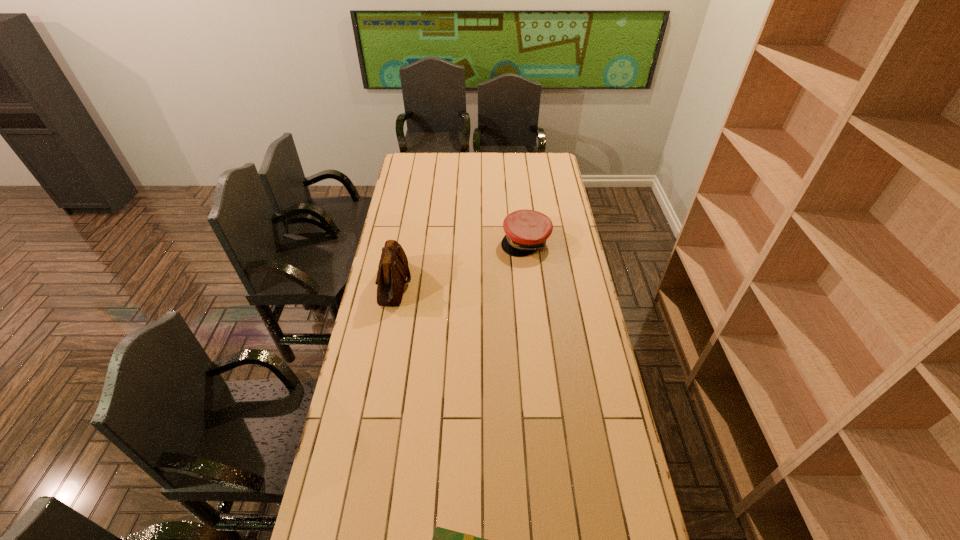
Where is `vacant space at the right edge`? The width and height of the screenshot is (960, 540). vacant space at the right edge is located at coordinates (568, 387).

Find the location of a particular element. The height and width of the screenshot is (540, 960). free location at the far right corner is located at coordinates (548, 172).

This screenshot has height=540, width=960. What are the coordinates of `vacant space that's between the rightmost object and the leftmost object` in the screenshot? It's located at (460, 262).

The height and width of the screenshot is (540, 960). I want to click on free spot between the rightmost object and the leftmost object, so click(460, 262).

Point out which object is positioned as the nearest to the farthest object. Please provide its 2D coordinates. Your answer should be formatted as a tuple, i.e. [(x, y)], where the tuple contains the x and y coordinates of a point satisfying the conditions above.

[(393, 269)]

Locate which object is the closest to the tallest object. Please provide its 2D coordinates. Your answer should be formatted as a tuple, i.e. [(x, y)], where the tuple contains the x and y coordinates of a point satisfying the conditions above.

[(527, 231)]